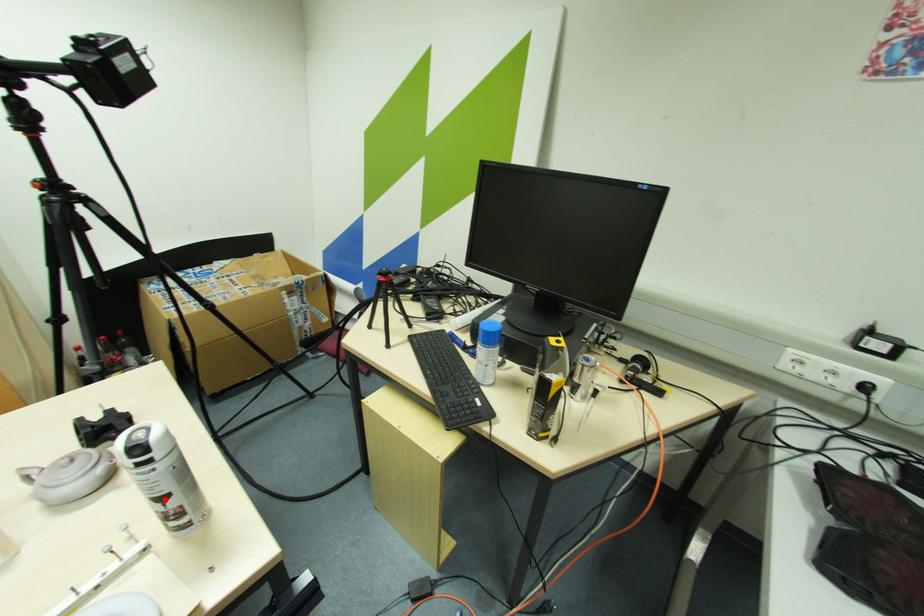
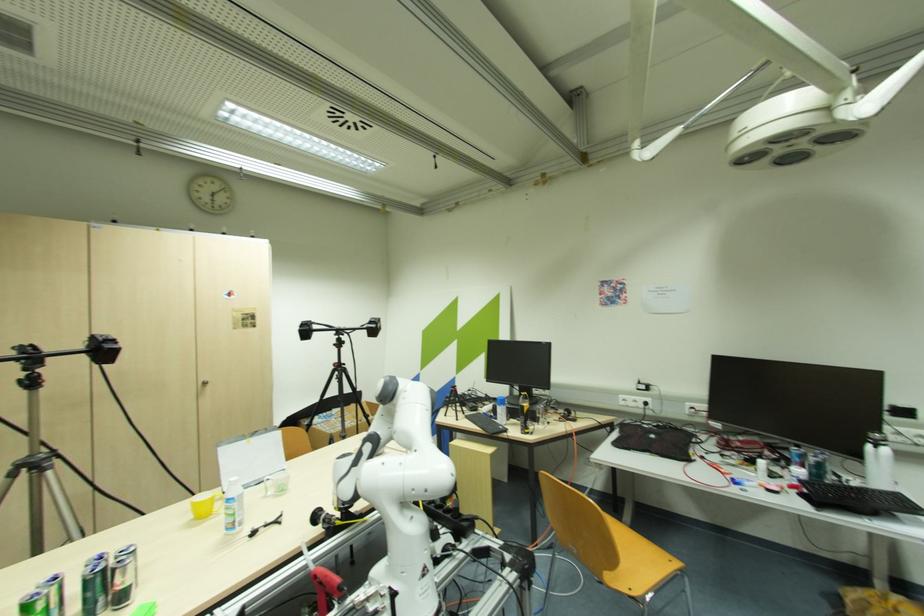
Question: I am providing you with two images of the same scene from different viewpoints. A red point is marked on the first image. At the location where the point appears in image 1, is it still visible in image 2?

Choices:
 (A) Yes
 (B) No

Answer: (B)